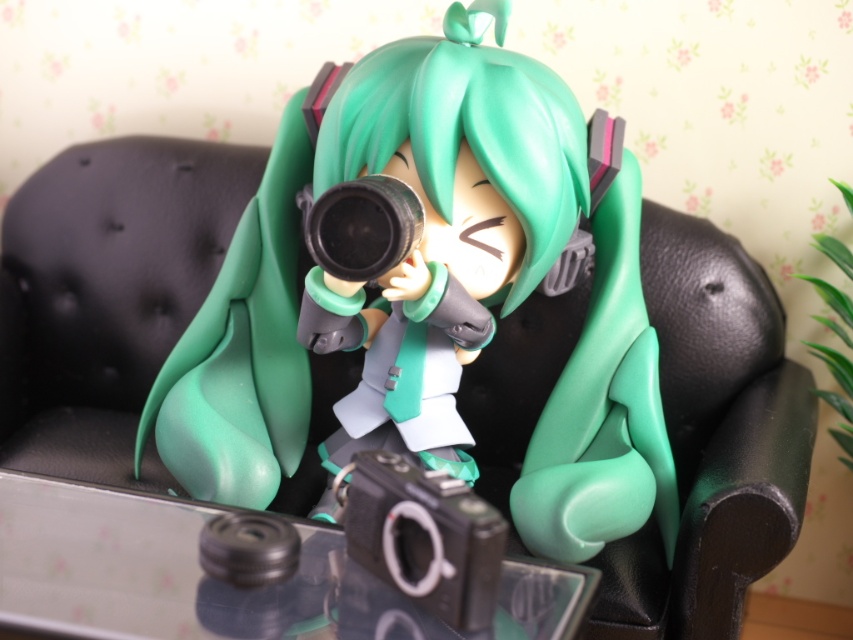
Question: Among these points, which one is farthest from the camera?

Choices:
 (A) (297, 536)
 (B) (97, 547)
 (C) (589, 436)

Answer: (C)

Question: Is matte green figure at center wider than transparent glass camera at lower center?

Choices:
 (A) yes
 (B) no

Answer: (A)

Question: Does matte green figure at center have a smaller size compared to transparent glass camera at lower center?

Choices:
 (A) no
 (B) yes

Answer: (A)

Question: Is matte green figure at center closer to camera compared to black plastic lens at center?

Choices:
 (A) yes
 (B) no

Answer: (B)

Question: Estimate the real-world distances between objects in this image. Which object is farther from the black rubber lens at center?

Choices:
 (A) matte green figure at center
 (B) black plastic lens at center
 (C) transparent glass camera at lower center

Answer: (A)

Question: Which point is closer to the camera?

Choices:
 (A) black rubber lens at center
 (B) matte green figure at center

Answer: (A)